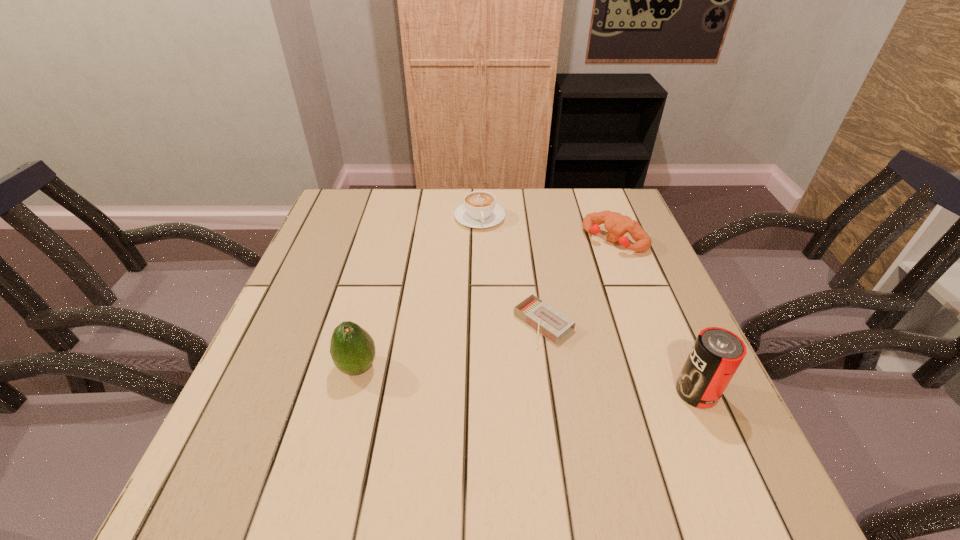
Where is `vacant space located with the gloves of the puncher facing forward`? This screenshot has width=960, height=540. vacant space located with the gloves of the puncher facing forward is located at coordinates (518, 335).

The width and height of the screenshot is (960, 540). What are the coordinates of `vacant space located with the gloves of the puncher facing forward` in the screenshot? It's located at (516, 338).

Where is `vacant space located with the gloves of the puncher facing forward`? The image size is (960, 540). vacant space located with the gloves of the puncher facing forward is located at coordinates (583, 269).

The height and width of the screenshot is (540, 960). Identify the location of free space located on the striking surface of the third farthest object. (431, 416).

Identify the location of vacant space situated on the striking surface of the third farthest object. Image resolution: width=960 pixels, height=540 pixels. (478, 379).

Image resolution: width=960 pixels, height=540 pixels. What are the coordinates of `vacant space located 0.260m on the striking surface of the third farthest object` in the screenshot? It's located at (431, 416).

Find the location of `vacant area situated 0.370m on the side of the cappuccino with the handle`. vacant area situated 0.370m on the side of the cappuccino with the handle is located at coordinates (506, 326).

I want to click on free space located on the side of the cappuccino with the handle, so click(x=486, y=242).

What are the coordinates of `free location located on the side of the cappuccino with the handle` in the screenshot? It's located at (489, 253).

Identify the location of puncher that is at the far edge. (617, 225).